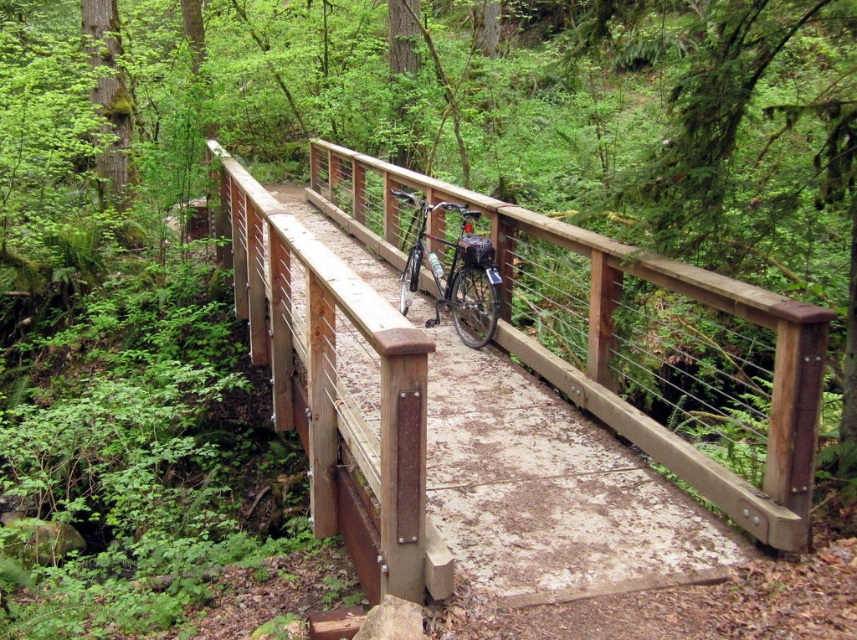
You are planning to cross the brown wooden bridge at center with the silver metallic bicycle at center. Based on their sizes, will the bicycle fit comfortably on the bridge?

The brown wooden bridge at center has a smaller size compared to silver metallic bicycle at center, so the bicycle may not fit comfortably on the bridge due to the bridge being narrower than the bicycle.

You are a cyclist planning to cross the brown wooden bridge at center. Your silver metallic bicycle at center is currently parked 3.55 meters away from the bridge. Can you safely ride your bicycle onto the bridge without needing to push it?

The distance between the brown wooden bridge at center and the silver metallic bicycle at center is 3.55 meters. Since this distance allows enough space for mounting and starting to ride, you can safely ride your bicycle onto the bridge without needing to push it.